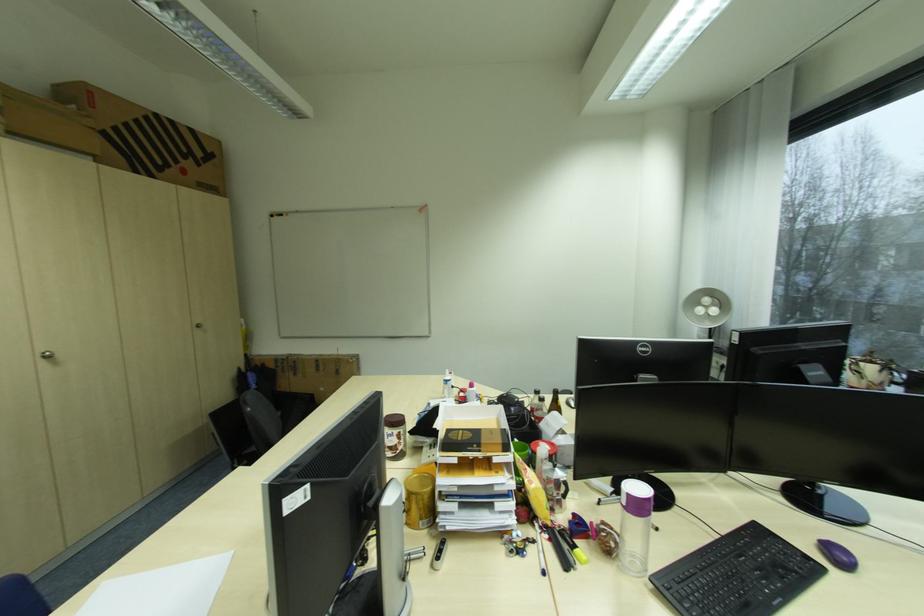
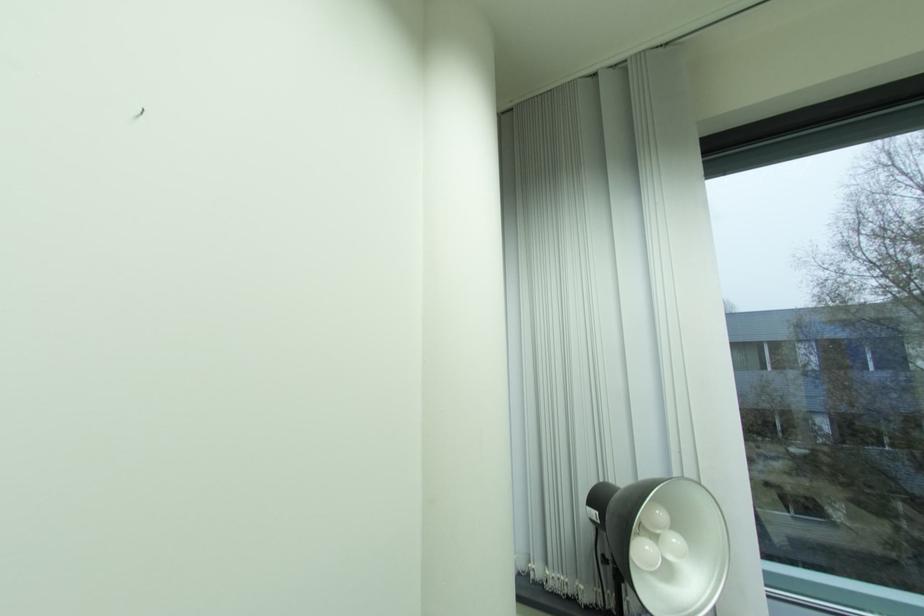
Find the pixel in the second image that matches point 713,305 in the first image.

(665, 531)